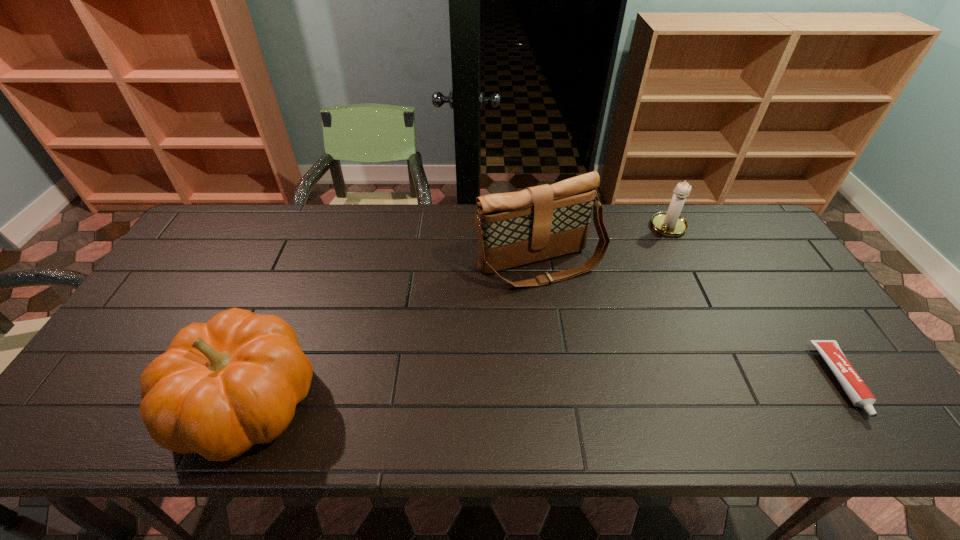
In order to click on vacant space on the desktop that is between the leftmost object and the toothpaste and is positioned on the front-facing side of the second farthest object in this screenshot , I will do `click(622, 389)`.

This screenshot has width=960, height=540. Identify the location of vacant spot on the desktop that is between the leftmost object and the rightmost object and is positioned on the handle side of the third object from left to right. (551, 392).